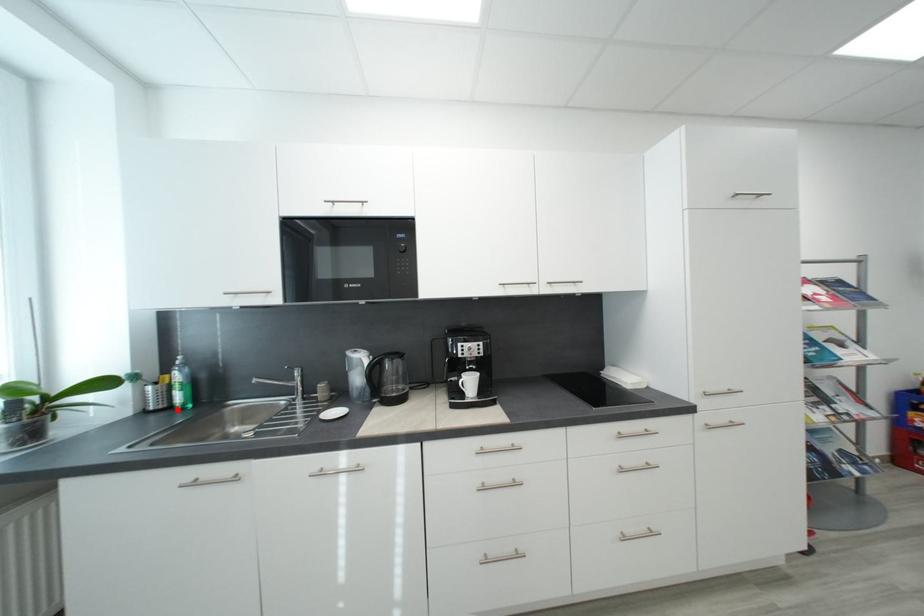
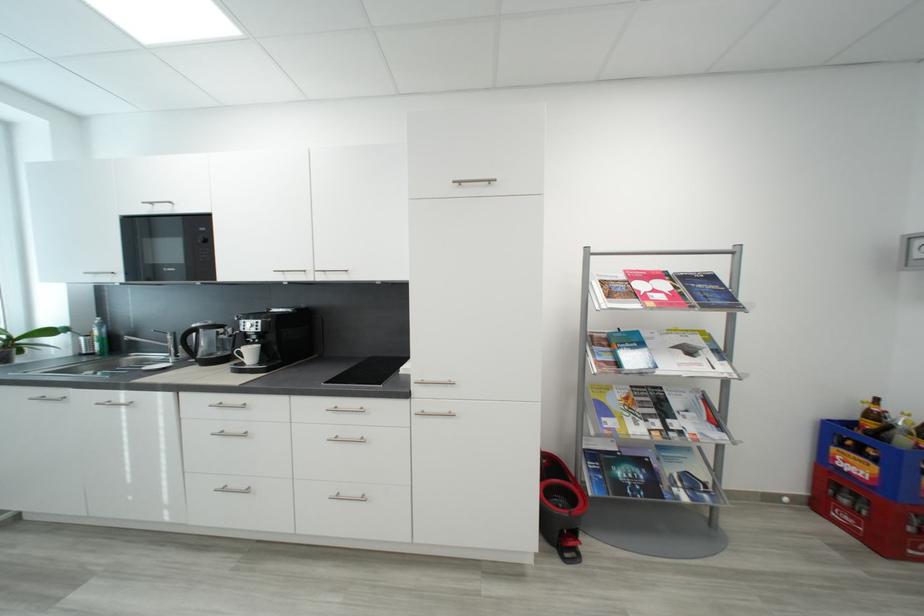
In the second image, find the point that corresponds to the highlighted location in the first image.

(100, 355)